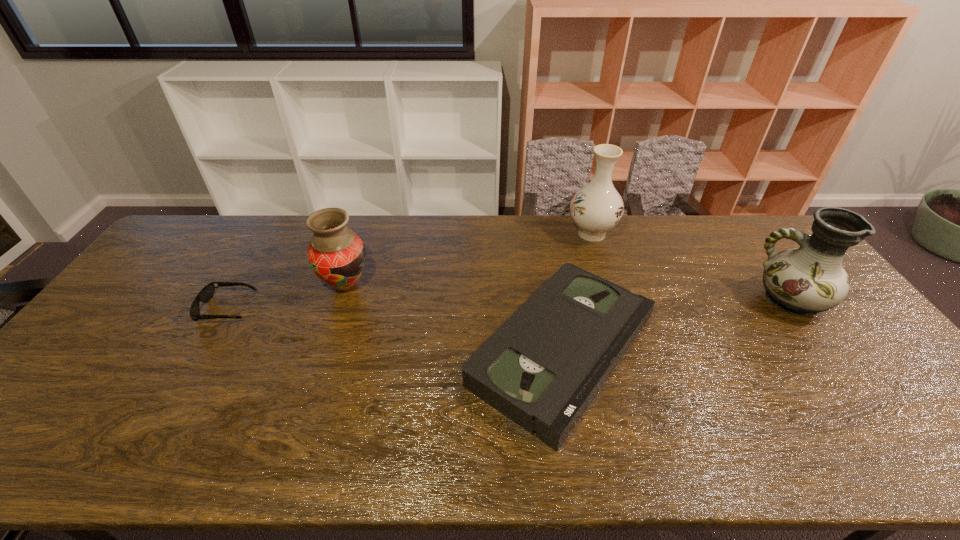
The image size is (960, 540). I want to click on vacant area situated 0.180m on the right of the shortest vase, so click(430, 285).

You are a GUI agent. You are given a task and a screenshot of the screen. Output one action in this format:
    pyautogui.click(x=<x>, y=<y>)
    Task: Click on the free space located 0.130m on the right of the videotape
    The image size is (960, 540).
    Given the screenshot: What is the action you would take?
    pyautogui.click(x=710, y=350)

Image resolution: width=960 pixels, height=540 pixels. Identify the location of vacant space located on the front-facing side of the sunglasses. click(x=380, y=309).

Identify the location of object that is at the far edge. This screenshot has width=960, height=540. (596, 208).

In order to click on object present at the near edge in this screenshot , I will do `click(542, 368)`.

Image resolution: width=960 pixels, height=540 pixels. Identify the location of object at the right edge. (808, 280).

The height and width of the screenshot is (540, 960). I want to click on free space at the far edge, so click(369, 239).

In the image, there is a desktop. Identify the location of vacant region at the near edge. (571, 462).

This screenshot has width=960, height=540. In order to click on free spot at the right edge of the desktop in this screenshot , I will do `click(851, 389)`.

The image size is (960, 540). I want to click on vacant space at the far left corner of the desktop, so click(196, 249).